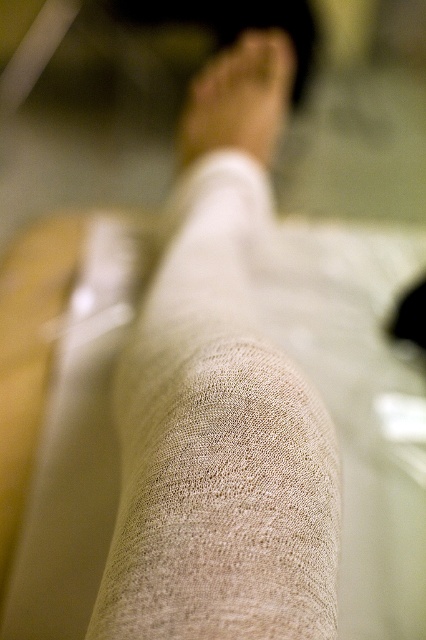
Question: Is beige knitted leg at center wider than beige fabric foot at center?

Choices:
 (A) no
 (B) yes

Answer: (A)

Question: Which point is closer to the camera?

Choices:
 (A) (219, 342)
 (B) (279, 125)

Answer: (A)

Question: Among these objects, which one is nearest to the camera?

Choices:
 (A) beige fabric foot at center
 (B) beige knitted leg at center

Answer: (B)

Question: Does beige knitted leg at center have a lesser width compared to beige fabric foot at center?

Choices:
 (A) yes
 (B) no

Answer: (A)

Question: In this image, where is beige knitted leg at center located relative to beige fabric foot at center?

Choices:
 (A) below
 (B) above

Answer: (A)